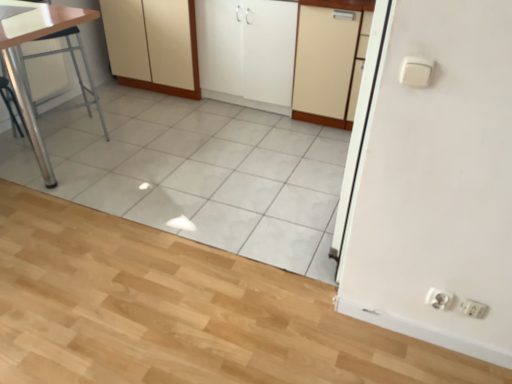
Question: Is white glossy sink at upper left oriented away from white matte cabinet at center, the 3th cabinetry when ordered from right to left?

Choices:
 (A) yes
 (B) no

Answer: (B)

Question: Considering the relative sizes of white glossy sink at upper left and white matte cabinet at center, the first cabinetry from the left, in the image provided, is white glossy sink at upper left taller than white matte cabinet at center, the first cabinetry from the left,?

Choices:
 (A) no
 (B) yes

Answer: (A)

Question: Is white matte cabinet at center, the first cabinetry from the left, surrounded by white glossy sink at upper left?

Choices:
 (A) yes
 (B) no

Answer: (B)

Question: Can we say white glossy sink at upper left lies outside white matte cabinet at center, the 3th cabinetry when ordered from right to left?

Choices:
 (A) yes
 (B) no

Answer: (A)

Question: Does white glossy sink at upper left have a greater width compared to white matte cabinet at center, the 3th cabinetry when ordered from right to left?

Choices:
 (A) no
 (B) yes

Answer: (A)

Question: From the image's perspective, is white glossy sink at upper left on white matte cabinet at center, the first cabinetry from the left?

Choices:
 (A) yes
 (B) no

Answer: (B)

Question: Is white plastic electric outlet at lower right, the 1th electric outlet in the left-to-right sequence, thinner than metallic silver table at left?

Choices:
 (A) no
 (B) yes

Answer: (B)

Question: Is the depth of white plastic electric outlet at lower right, the 1th electric outlet in the left-to-right sequence, greater than that of metallic silver table at left?

Choices:
 (A) no
 (B) yes

Answer: (A)

Question: From the image's perspective, is white plastic electric outlet at lower right, positioned as the second electric outlet in right-to-left order, above metallic silver table at left?

Choices:
 (A) yes
 (B) no

Answer: (B)

Question: Can you confirm if white plastic electric outlet at lower right, the 1th electric outlet in the left-to-right sequence, is positioned to the left of metallic silver table at left?

Choices:
 (A) yes
 (B) no

Answer: (B)

Question: From the image's perspective, is white plastic electric outlet at lower right, positioned as the second electric outlet in right-to-left order, under metallic silver table at left?

Choices:
 (A) yes
 (B) no

Answer: (A)

Question: Can you see white plastic electric outlet at lower right, positioned as the second electric outlet in right-to-left order, touching metallic silver table at left?

Choices:
 (A) no
 (B) yes

Answer: (A)

Question: Is beige matte cabinet at center, the third cabinetry when ordered from left to right, not inside white matte cabinet at center, which ranks as the 2th cabinetry in right-to-left order?

Choices:
 (A) yes
 (B) no

Answer: (A)